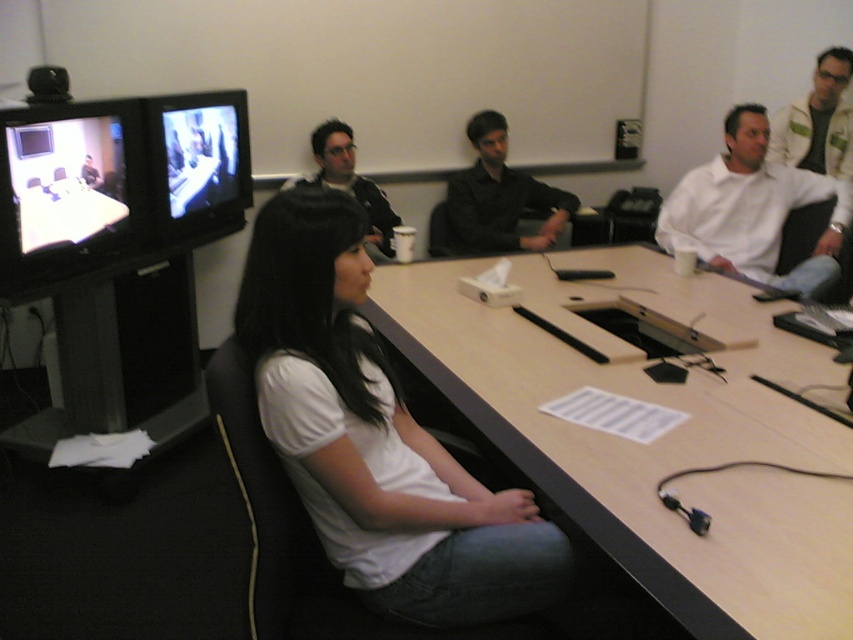
Is light brown wood table at center thinner than matte black jacket at center?

No.

Does point (558, 381) lie behind point (370, 256)?

No, (558, 381) is in front of (370, 256).

At what (x,y) coordinates should I click in order to perform the action: click on light brown wood table at center. Please return your answer as a coordinate pair (x, y). The height and width of the screenshot is (640, 853). Looking at the image, I should click on (654, 440).

Can you confirm if light brown wood table at center is positioned to the right of white matte shirt at center?

Correct, you'll find light brown wood table at center to the right of white matte shirt at center.

Measure the distance between light brown wood table at center and camera.

The distance of light brown wood table at center from camera is 3.28 feet.

Between point (517, 464) and point (294, 360), which one is positioned behind?

Positioned behind is point (517, 464).

Find the location of a particular element. This screenshot has height=640, width=853. light brown wood table at center is located at coordinates (654, 440).

Does dark gray shirt at center appear on the left side of white textured jacket at upper right?

Correct, you'll find dark gray shirt at center to the left of white textured jacket at upper right.

Who is positioned more to the left, dark gray shirt at center or white textured jacket at upper right?

dark gray shirt at center

Where is `dark gray shirt at center`? This screenshot has height=640, width=853. dark gray shirt at center is located at coordinates (498, 196).

This screenshot has width=853, height=640. Find the location of `dark gray shirt at center`. dark gray shirt at center is located at coordinates (498, 196).